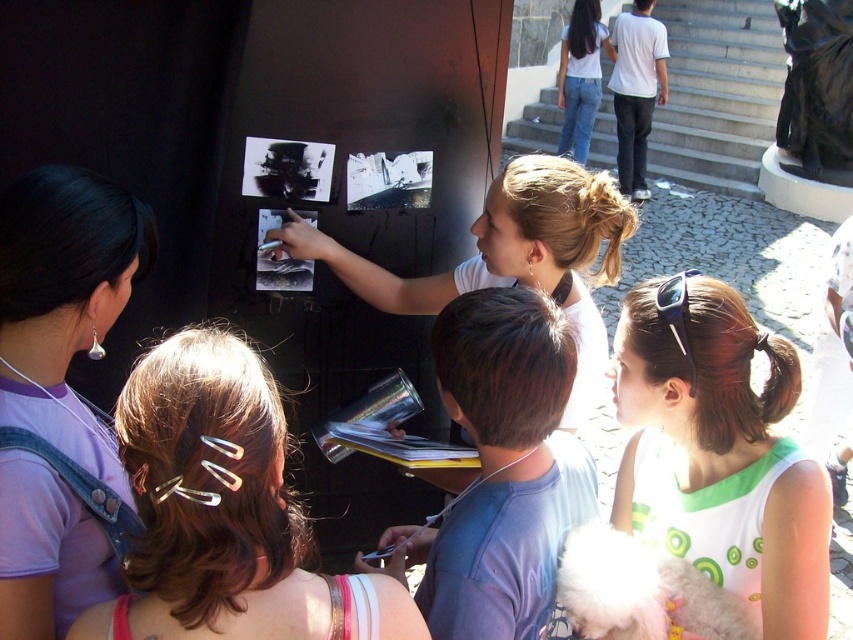
Question: Which is farther from the white fabric at center?

Choices:
 (A) silver hair clips at upper left
 (B) jeans at upper right
 (C) matte purple shirt at upper left

Answer: (B)

Question: Which point is farther to the camera?

Choices:
 (A) jeans at upper right
 (B) matte white shirt at center
 (C) matte purple shirt at upper left

Answer: (A)

Question: Does white fabric at center have a greater width compared to matte white shirt at center?

Choices:
 (A) no
 (B) yes

Answer: (A)

Question: Estimate the real-world distances between objects in this image. Which object is farther from the white fabric at center?

Choices:
 (A) matte white shirt at center
 (B) jeans at upper right

Answer: (B)

Question: Does silver hair clips at upper left come behind jeans at upper right?

Choices:
 (A) yes
 (B) no

Answer: (B)

Question: Is silver hair clips at upper left positioned at the back of white fabric at center?

Choices:
 (A) yes
 (B) no

Answer: (B)